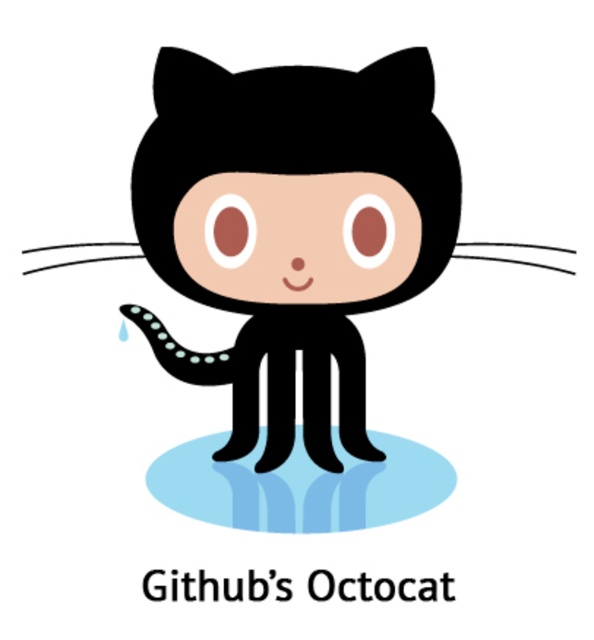
Question: Does black matte octopus at center appear under blue glossy puddle at center?

Choices:
 (A) no
 (B) yes

Answer: (A)

Question: Among these points, which one is nearest to the camera?

Choices:
 (A) (170, 460)
 (B) (208, 81)

Answer: (B)

Question: Which object appears farthest from the camera in this image?

Choices:
 (A) black matte octopus at center
 (B) blue glossy puddle at center

Answer: (B)

Question: Which object is farther from the camera taking this photo?

Choices:
 (A) black matte octopus at center
 (B) blue glossy puddle at center

Answer: (B)

Question: Is black matte octopus at center smaller than blue glossy puddle at center?

Choices:
 (A) yes
 (B) no

Answer: (B)

Question: Does black matte octopus at center have a greater width compared to blue glossy puddle at center?

Choices:
 (A) no
 (B) yes

Answer: (B)